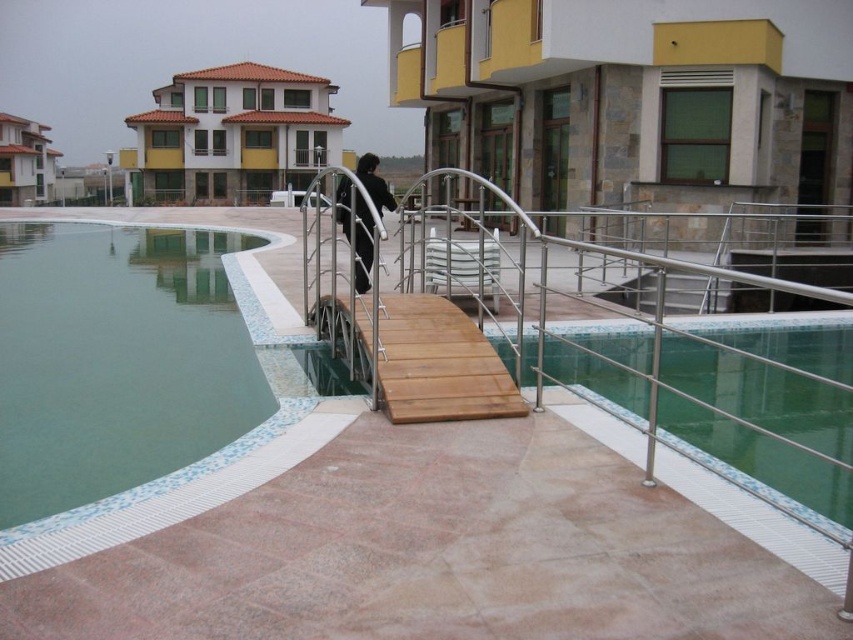
Is metallic silver stair at center smaller than black matte clothing at center?

Correct, metallic silver stair at center occupies less space than black matte clothing at center.

Is metallic silver stair at center below black matte clothing at center?

Correct, metallic silver stair at center is located below black matte clothing at center.

Is point (689, 273) closer to viewer compared to point (363, 173)?

No, (689, 273) is further to viewer.

I want to click on metallic silver stair at center, so click(x=694, y=292).

Does smooth tile swimming pool at center have a lesser height compared to metallic silver stair at center?

In fact, smooth tile swimming pool at center may be taller than metallic silver stair at center.

Is smooth tile swimming pool at center bigger than metallic silver stair at center?

Yes.

Is point (779, 472) behind point (668, 276)?

No, it is not.

Locate an element on the screen. This screenshot has height=640, width=853. smooth tile swimming pool at center is located at coordinates (761, 394).

Consider the image. Measure the distance between smooth tile swimming pool at center and camera.

The distance of smooth tile swimming pool at center from camera is 4.79 meters.

Who is more distant from viewer, (801,428) or (363,236)?

The point (363,236) is more distant.

Image resolution: width=853 pixels, height=640 pixels. What are the coordinates of `smooth tile swimming pool at center` in the screenshot? It's located at (761, 394).